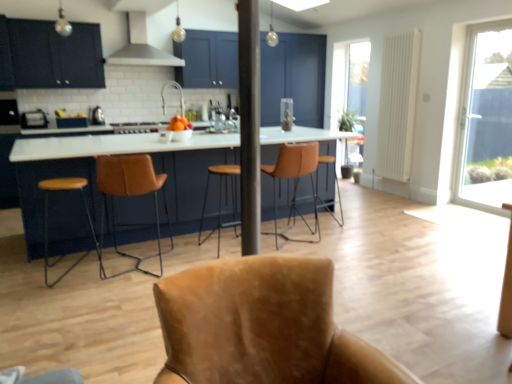
Question: Is matte black toaster at left, the 2th appliance in the right-to-left sequence, at the left side of brown leather stool at left, placed as the second chair when sorted from back to front?

Choices:
 (A) no
 (B) yes

Answer: (B)

Question: Are matte black toaster at left, positioned as the second appliance in back-to-front order, and brown leather stool at left, which is counted as the 3th chair, starting from the front, beside each other?

Choices:
 (A) no
 (B) yes

Answer: (A)

Question: Is matte black toaster at left, marked as the second appliance in a front-to-back arrangement, positioned in front of brown leather stool at left, which is counted as the 3th chair, starting from the front?

Choices:
 (A) no
 (B) yes

Answer: (A)

Question: Is matte black toaster at left, positioned as the second appliance in back-to-front order, looking in the opposite direction of brown leather stool at left, placed as the second chair when sorted from back to front?

Choices:
 (A) no
 (B) yes

Answer: (A)

Question: Is matte black toaster at left, which is the second appliance in left-to-right order, facing towards brown leather stool at left, which is counted as the 3th chair, starting from the front?

Choices:
 (A) yes
 (B) no

Answer: (A)

Question: From the image's perspective, is leather bar stool at center, placed as the first chair when sorted from back to front, above or below white glossy table at center?

Choices:
 (A) above
 (B) below

Answer: (B)

Question: Does point (285, 162) appear closer or farther from the camera than point (165, 195)?

Choices:
 (A) farther
 (B) closer

Answer: (B)

Question: Visually, is leather bar stool at center, placed as the first chair when sorted from back to front, positioned to the left or to the right of white glossy table at center?

Choices:
 (A) left
 (B) right

Answer: (B)

Question: Is leather bar stool at center, which is the 4th chair from front to back, spatially inside white glossy table at center, or outside of it?

Choices:
 (A) inside
 (B) outside

Answer: (A)

Question: Do you think matte black cabinets at upper left is within satin silver metal at upper center, or outside of it?

Choices:
 (A) inside
 (B) outside

Answer: (B)

Question: From a real-world perspective, is matte black cabinets at upper left positioned above or below satin silver metal at upper center?

Choices:
 (A) above
 (B) below

Answer: (B)

Question: Considering the positions of matte black cabinets at upper left and satin silver metal at upper center in the image, is matte black cabinets at upper left bigger or smaller than satin silver metal at upper center?

Choices:
 (A) small
 (B) big

Answer: (A)

Question: From the image's perspective, is matte black cabinets at upper left positioned above or below satin silver metal at upper center?

Choices:
 (A) below
 (B) above

Answer: (A)

Question: Is point (102, 117) closer or farther from the camera than point (232, 192)?

Choices:
 (A) closer
 (B) farther

Answer: (A)

Question: Is satin silver toaster at left, acting as the first appliance starting from the back, spatially inside brown leather bar stool at center, the 2th bar stool positioned from the back, or outside of it?

Choices:
 (A) inside
 (B) outside

Answer: (B)